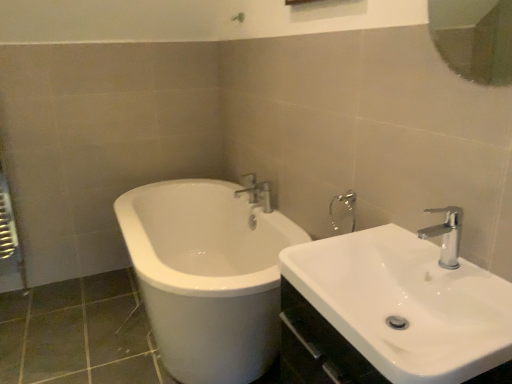
Question: Is chrome metallic faucet at upper right, the second tap positioned from the back, looking in the opposite direction of glossy glass mirror at upper right?

Choices:
 (A) yes
 (B) no

Answer: (B)

Question: From the image's perspective, would you say chrome metallic faucet at upper right, which ranks as the 1th tap in right-to-left order, is positioned over glossy glass mirror at upper right?

Choices:
 (A) no
 (B) yes

Answer: (A)

Question: Is glossy glass mirror at upper right completely or partially inside chrome metallic faucet at upper right, the second tap when ordered from left to right?

Choices:
 (A) no
 (B) yes

Answer: (A)

Question: Is chrome metallic faucet at upper right, the second tap positioned from the back, located outside glossy glass mirror at upper right?

Choices:
 (A) no
 (B) yes

Answer: (B)

Question: Considering the relative positions of chrome metallic faucet at upper right, which is counted as the 1th tap, starting from the front, and glossy glass mirror at upper right in the image provided, is chrome metallic faucet at upper right, which is counted as the 1th tap, starting from the front, to the left of glossy glass mirror at upper right from the viewer's perspective?

Choices:
 (A) no
 (B) yes

Answer: (B)

Question: Considering the relative sizes of chrome metallic faucet at upper right, the second tap positioned from the back, and glossy glass mirror at upper right in the image provided, is chrome metallic faucet at upper right, the second tap positioned from the back, thinner than glossy glass mirror at upper right?

Choices:
 (A) no
 (B) yes

Answer: (A)

Question: From a real-world perspective, is glossy glass mirror at upper right physically below white glossy sink at lower right?

Choices:
 (A) no
 (B) yes

Answer: (A)

Question: Can you confirm if glossy glass mirror at upper right is shorter than white glossy sink at lower right?

Choices:
 (A) yes
 (B) no

Answer: (B)

Question: Does glossy glass mirror at upper right have a smaller size compared to white glossy sink at lower right?

Choices:
 (A) no
 (B) yes

Answer: (B)

Question: Is glossy glass mirror at upper right turned away from white glossy sink at lower right?

Choices:
 (A) yes
 (B) no

Answer: (B)

Question: Does glossy glass mirror at upper right turn towards white glossy sink at lower right?

Choices:
 (A) yes
 (B) no

Answer: (B)

Question: Is there a large distance between glossy glass mirror at upper right and white glossy sink at lower right?

Choices:
 (A) yes
 (B) no

Answer: (A)

Question: Does white glossy sink at lower right appear on the right side of glossy glass mirror at upper right?

Choices:
 (A) no
 (B) yes

Answer: (A)